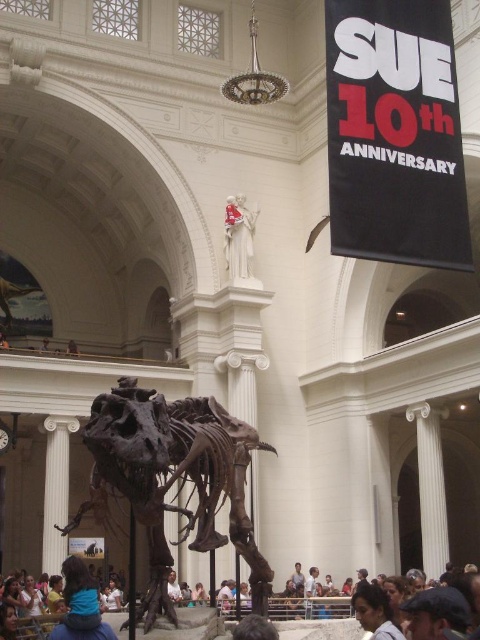
Question: Which of these objects is positioned closest to the white marble statue at upper center?

Choices:
 (A) blue fabric at lower left
 (B) shiny metallic dinosaur skeleton at center

Answer: (B)

Question: Which point is farther to the camera?

Choices:
 (A) (252, 240)
 (B) (212, 513)

Answer: (A)

Question: Can you confirm if matte brown hair at lower center is positioned to the left of white marble statue at upper center?

Choices:
 (A) yes
 (B) no

Answer: (B)

Question: Is blue fabric at lower left positioned behind white marble statue at upper center?

Choices:
 (A) no
 (B) yes

Answer: (A)

Question: Which point appears farthest from the camera in this image?

Choices:
 (A) (228, 257)
 (B) (80, 634)
 (C) (172, 612)
 (D) (156, 624)

Answer: (A)

Question: Does matte brown hair at lower center appear over blue fabric at lower left?

Choices:
 (A) no
 (B) yes

Answer: (A)